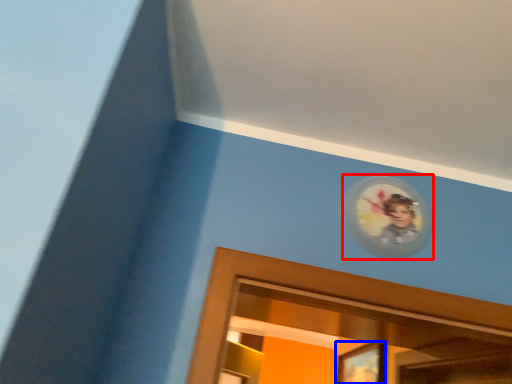
Question: Which object appears farthest to the camera in this image, picture frame (highlighted by a red box) or portrait (highlighted by a blue box)?

Choices:
 (A) picture frame
 (B) portrait

Answer: (B)